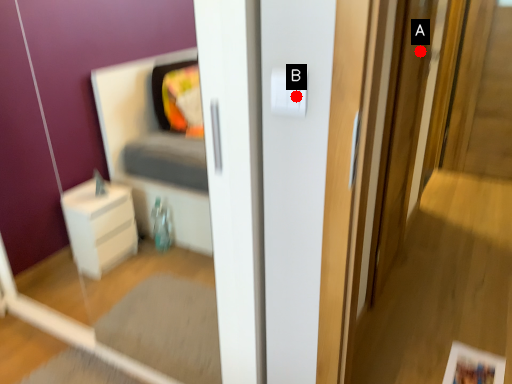
Question: Two points are circled on the image, labeled by A and B beside each circle. Which point is farther to the camera?

Choices:
 (A) A is further
 (B) B is further

Answer: (A)